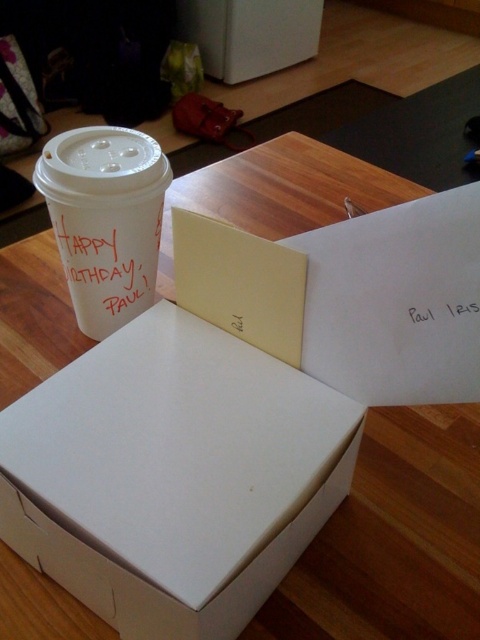
Does white paper cup at upper left appear over white paper at upper center?

Correct, white paper cup at upper left is located above white paper at upper center.

Who is positioned more to the right, white paper cup at upper left or white paper at upper center?

Positioned to the right is white paper at upper center.

Identify the location of white paper cup at upper left. (106, 220).

Where is `white paper cup at upper left`? white paper cup at upper left is located at coordinates (106, 220).

Is white paper cup at upper left bigger than black paper at upper right?

Yes.

Who is more distant from viewer, (154, 234) or (448, 301)?

The point (154, 234) is behind.

Is point (90, 182) farther from viewer compared to point (478, 300)?

Yes, it is.

The width and height of the screenshot is (480, 640). I want to click on white paper cup at upper left, so click(106, 220).

Can you confirm if white paper at upper center is smaller than black paper at upper right?

No.

Does white paper at upper center appear over black paper at upper right?

Correct, white paper at upper center is located above black paper at upper right.

This screenshot has height=640, width=480. I want to click on white paper at upper center, so click(108, 262).